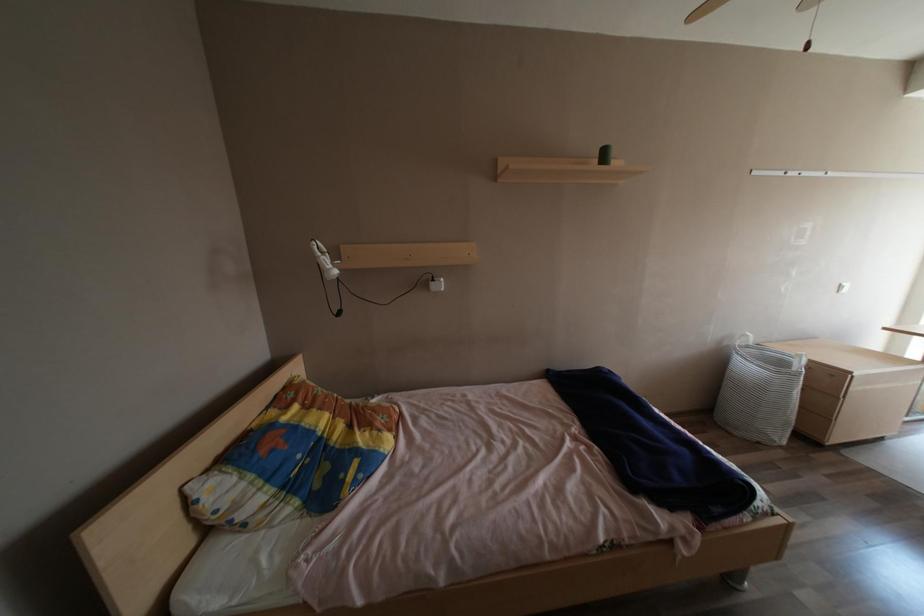
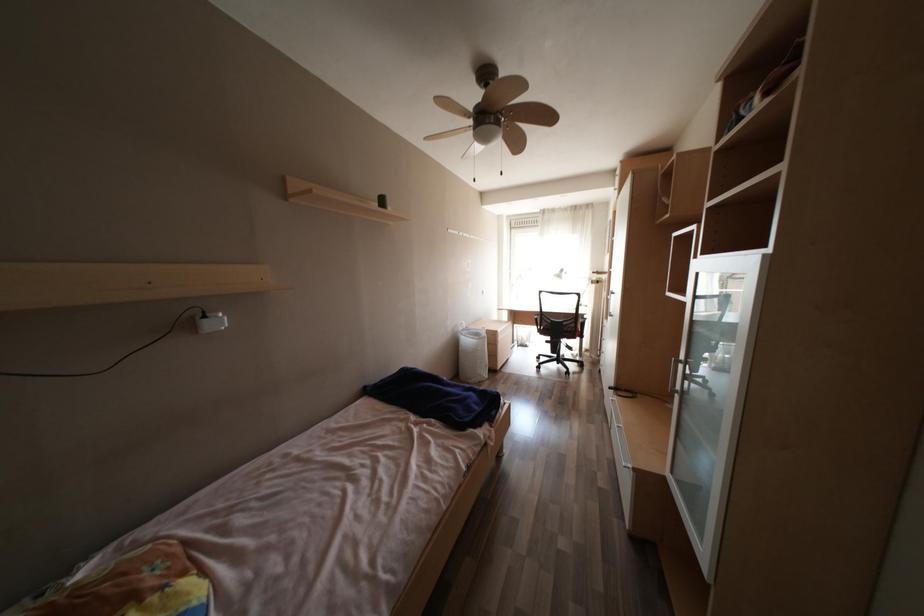
Question: The camera is either moving clockwise (left) or counter-clockwise (right) around the object. The first image is from the beginning of the video and the second image is from the end. Is the camera moving left or right when shooting the video?

Choices:
 (A) Left
 (B) Right

Answer: (A)